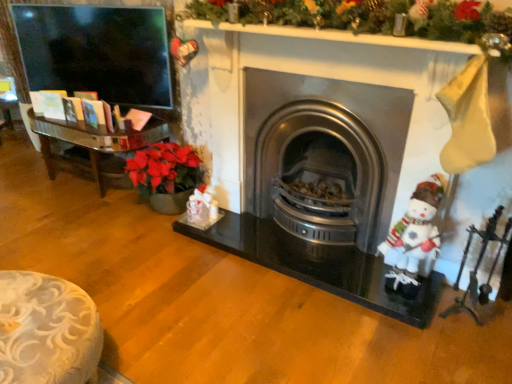
Image resolution: width=512 pixels, height=384 pixels. Find the location of `empty space that is to the right of metallic silver fireplace tools at right`. empty space that is to the right of metallic silver fireplace tools at right is located at coordinates (499, 325).